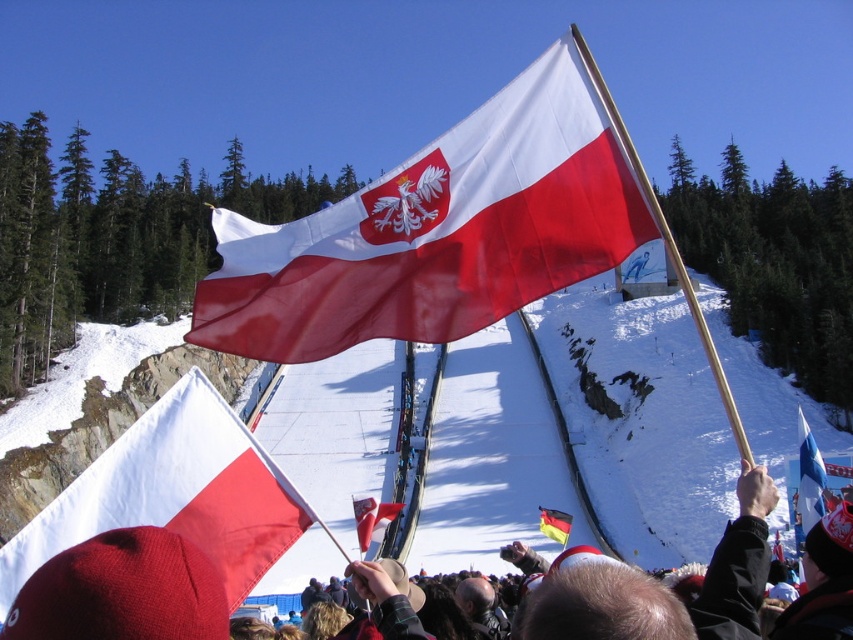
You are a photographer positioned at the edge of the ski jump ramp. You want to capture both the matte fabric flag at center and the matte red flag at center in a single shot. Given that your camera has a maximum focal length that allows capturing objects up to 25 meters apart, will you be able to include both flags in the photo?

The matte fabric flag at center and the matte red flag at center are 25.94 meters apart from each other. Since the maximum distance your camera can capture is 25 meters, the 25.94 meters exceeds this limit. Therefore, you won not be able to include both flags in the photo.

You are a photographer at the winter sports event. You need to capture a photo that includes both the matte fabric flag at center and the matte red flag at center. Which flag should you zoom in on to ensure both are fully visible in the frame?

The matte fabric flag at center is much taller than the matte red flag at center. To ensure both are fully visible, you should zoom out slightly so that the taller matte fabric flag at center fits within the frame while still including the matte red flag at center.